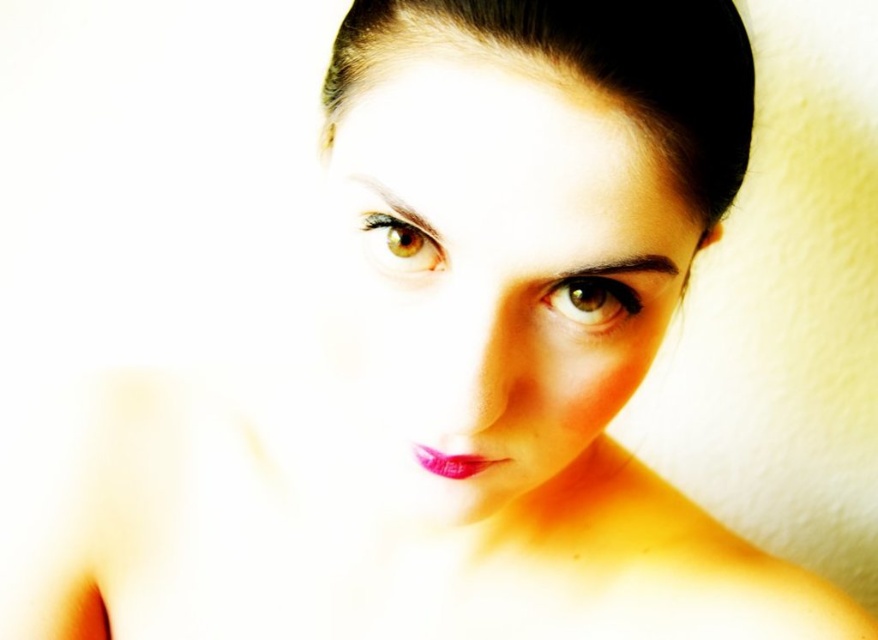
Question: Does black shiny hair at upper center come behind shiny pink lipstick at center?

Choices:
 (A) yes
 (B) no

Answer: (B)

Question: Which point is farther from the camera taking this photo?

Choices:
 (A) (429, 266)
 (B) (465, 445)

Answer: (B)

Question: Is smooth skin face at center bigger than shiny pink lipstick at center?

Choices:
 (A) yes
 (B) no

Answer: (A)

Question: Which object appears farthest from the camera in this image?

Choices:
 (A) smooth skin face at center
 (B) shiny pink lipstick at center
 (C) black shiny hair at upper center

Answer: (B)

Question: Can you confirm if brown glossy eye at center is bigger than shiny pink lipstick at center?

Choices:
 (A) no
 (B) yes

Answer: (B)

Question: Which object appears farthest from the camera in this image?

Choices:
 (A) brown glossy eye at center
 (B) smooth skin face at center

Answer: (A)